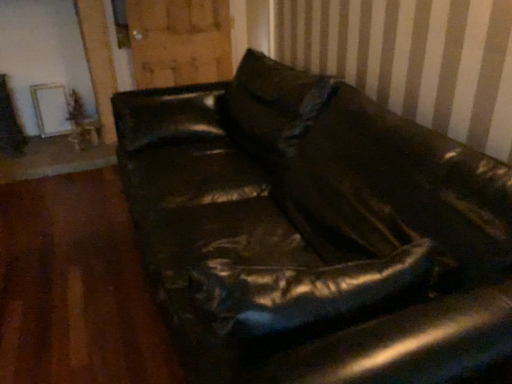
Question: From the image's perspective, is wooden at upper center located beneath wooden table at lower left?

Choices:
 (A) no
 (B) yes

Answer: (A)

Question: Is wooden at upper center positioned behind wooden table at lower left?

Choices:
 (A) no
 (B) yes

Answer: (A)

Question: Does wooden at upper center appear on the right side of wooden table at lower left?

Choices:
 (A) no
 (B) yes

Answer: (B)

Question: Can wooden table at lower left be found inside wooden at upper center?

Choices:
 (A) no
 (B) yes

Answer: (A)

Question: Considering the relative sizes of wooden at upper center and wooden table at lower left in the image provided, is wooden at upper center shorter than wooden table at lower left?

Choices:
 (A) yes
 (B) no

Answer: (B)

Question: Is wooden at upper center at the left side of wooden table at lower left?

Choices:
 (A) no
 (B) yes

Answer: (A)

Question: Would you say wooden at upper center contains leather couch at center?

Choices:
 (A) yes
 (B) no

Answer: (B)

Question: From a real-world perspective, is wooden at upper center positioned under leather couch at center based on gravity?

Choices:
 (A) yes
 (B) no

Answer: (B)

Question: Is wooden at upper center bigger than leather couch at center?

Choices:
 (A) no
 (B) yes

Answer: (A)

Question: Is wooden at upper center far away from leather couch at center?

Choices:
 (A) yes
 (B) no

Answer: (A)

Question: Can you confirm if wooden at upper center is positioned to the left of leather couch at center?

Choices:
 (A) no
 (B) yes

Answer: (B)

Question: Does wooden at upper center have a lesser height compared to leather couch at center?

Choices:
 (A) yes
 (B) no

Answer: (A)

Question: From the image's perspective, is leather couch at center over wooden table at lower left?

Choices:
 (A) no
 (B) yes

Answer: (A)